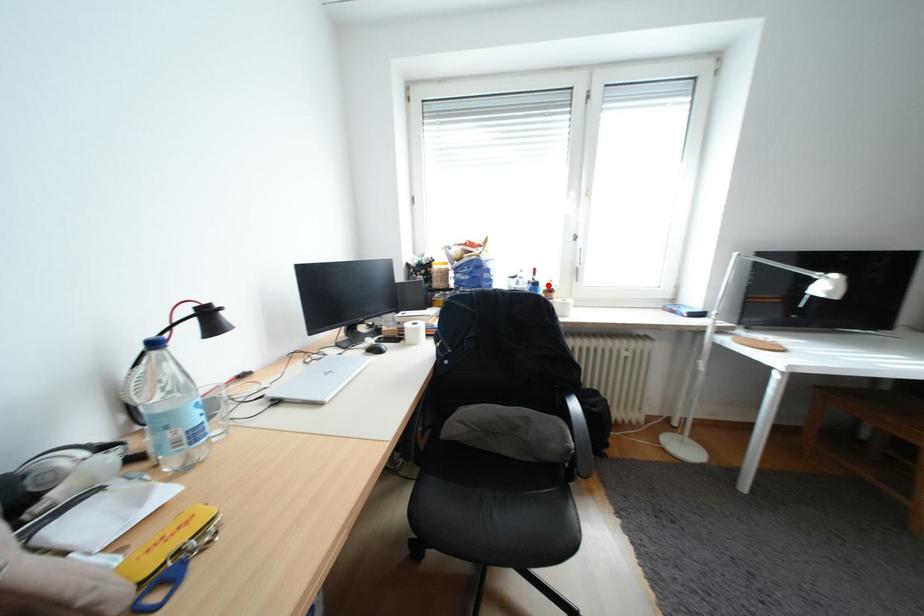
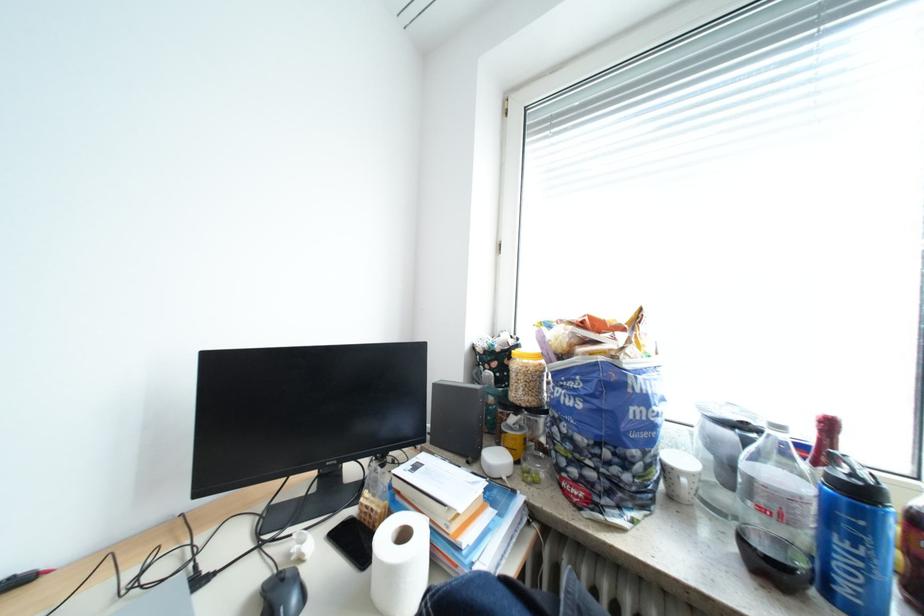
Where in the second image is the point corresponding to the highlighted location from the first image?

(873, 493)